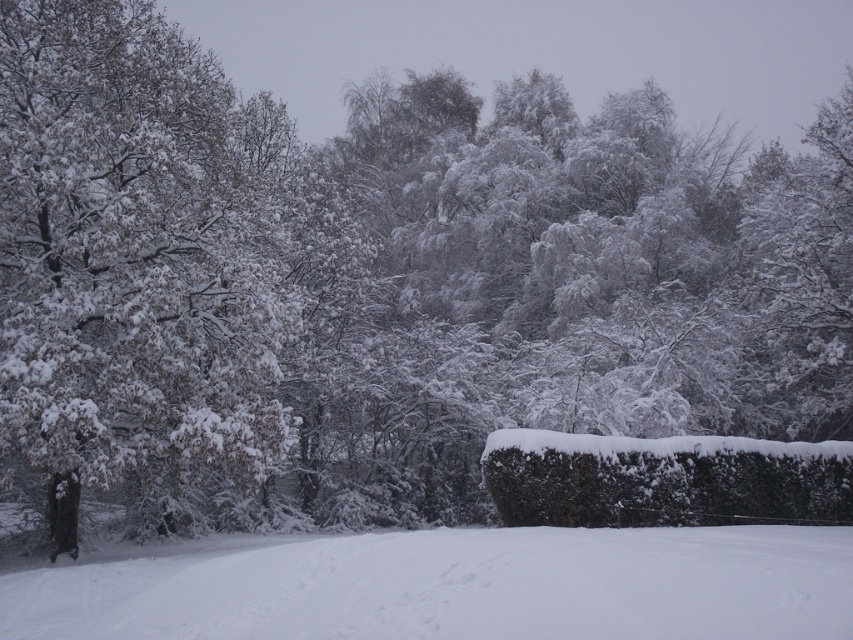
Question: Which point is farther to the camera?

Choices:
 (A) white frosty tree at upper right
 (B) white fluffy snow at lower center

Answer: (A)

Question: Can you confirm if white fluffy snow at lower center is bigger than white frosty tree at upper right?

Choices:
 (A) yes
 (B) no

Answer: (B)

Question: Is white snow-covered tree at left below white fluffy snow at lower center?

Choices:
 (A) no
 (B) yes

Answer: (A)

Question: Among these objects, which one is farthest from the camera?

Choices:
 (A) white frosty tree at upper right
 (B) green textured hedge at lower right
 (C) white fluffy snow at lower center

Answer: (A)

Question: Is white fluffy snow at lower center wider than white frosty tree at upper right?

Choices:
 (A) no
 (B) yes

Answer: (A)

Question: Estimate the real-world distances between objects in this image. Which object is farther from the white snow-covered tree at left?

Choices:
 (A) white fluffy snow at lower center
 (B) green textured hedge at lower right
 (C) white frosty tree at upper right

Answer: (C)